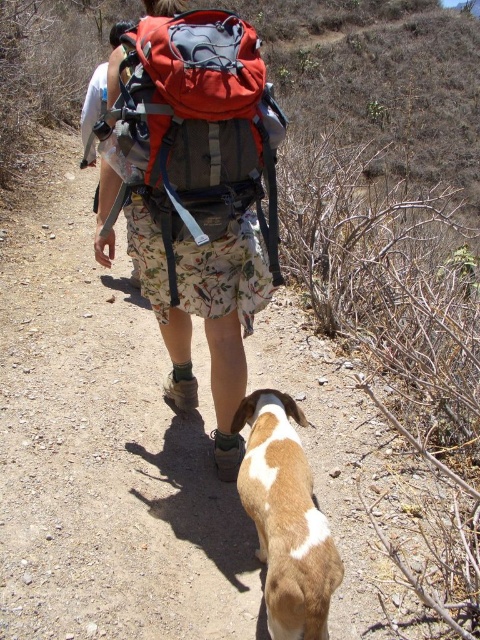
Question: Is matte red backpack at center further to camera compared to brown and white fur at lower center?

Choices:
 (A) no
 (B) yes

Answer: (B)

Question: Is matte red backpack at center to the left of brown and white fur at lower center from the viewer's perspective?

Choices:
 (A) no
 (B) yes

Answer: (B)

Question: Among these points, which one is nearest to the camera?

Choices:
 (A) (236, 429)
 (B) (183, 29)

Answer: (B)

Question: Among these points, which one is nearest to the camera?

Choices:
 (A) (267, 520)
 (B) (250, 177)

Answer: (A)

Question: Does matte red backpack at center come in front of brown and white fur at lower center?

Choices:
 (A) no
 (B) yes

Answer: (A)